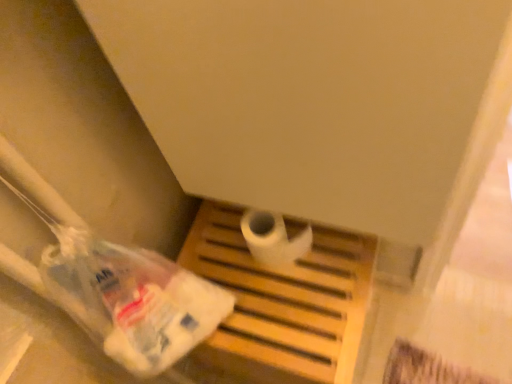
Identify the location of vacant space situated on the left part of white matte toilet paper at center. (225, 258).